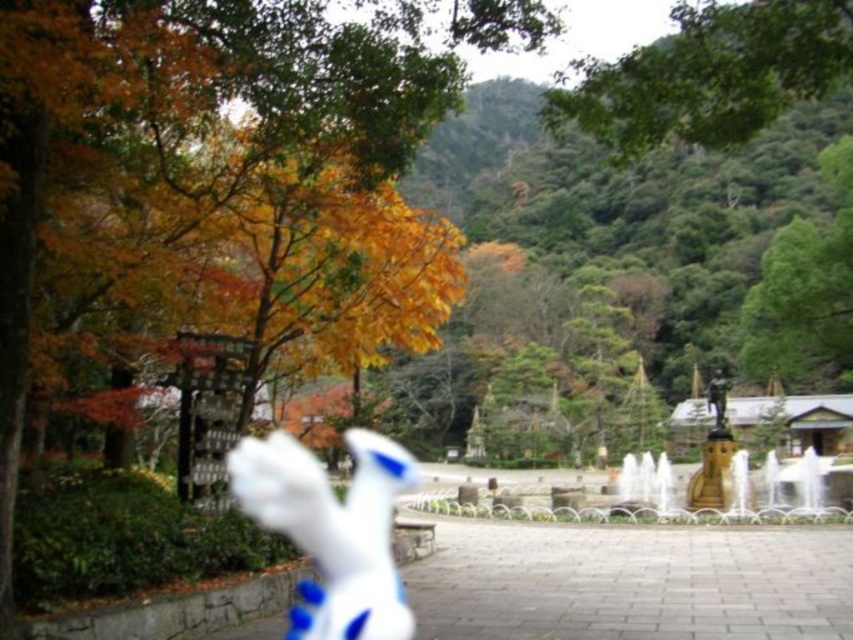
Question: Observing the image, what is the correct spatial positioning of white rubber toy at center in reference to gold metallic fountain at center right?

Choices:
 (A) right
 (B) left

Answer: (B)

Question: Can you confirm if green leafy tree at upper center is positioned to the left of white rubber toy at center?

Choices:
 (A) yes
 (B) no

Answer: (B)

Question: Does white rubber toy at center have a larger size compared to gold metallic fountain at center right?

Choices:
 (A) no
 (B) yes

Answer: (A)

Question: Considering the real-world distances, which object is farthest from the white rubber toy at center?

Choices:
 (A) gold metallic fountain at center right
 (B) green leafy tree at upper center

Answer: (A)

Question: Which object appears farthest from the camera in this image?

Choices:
 (A) green leafy tree at upper center
 (B) white rubber toy at center
 (C) gold metallic fountain at center right

Answer: (C)

Question: Based on their relative distances, which object is nearer to the white rubber toy at center?

Choices:
 (A) gold metallic fountain at center right
 (B) green leafy tree at upper center

Answer: (B)